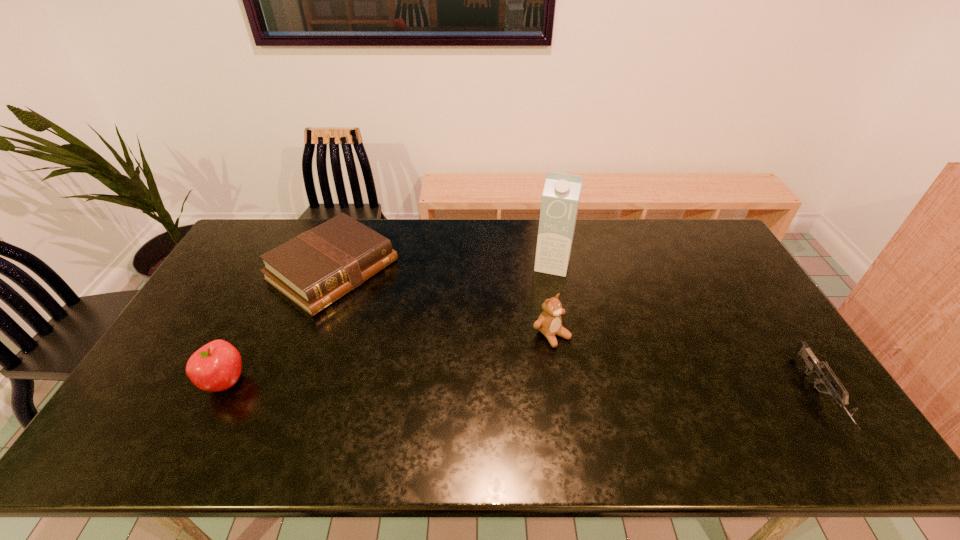
This screenshot has height=540, width=960. What are the coordinates of `the third closest object relative to the Bible` in the screenshot? It's located at (560, 200).

Identify which object is located as the nearest to the third farthest object. Please provide its 2D coordinates. Your answer should be formatted as a tuple, i.e. [(x, y)], where the tuple contains the x and y coordinates of a point satisfying the conditions above.

[(560, 200)]

This screenshot has width=960, height=540. What are the coordinates of `vacant position in the image that satisfies the following two spatial constraints: 1. on the front side of the teddy bear; 2. on the right side of the fourth tallest object` in the screenshot? It's located at (308, 335).

Image resolution: width=960 pixels, height=540 pixels. I want to click on vacant space that satisfies the following two spatial constraints: 1. on the back side of the third nearest object; 2. on the left side of the apple, so click(x=249, y=335).